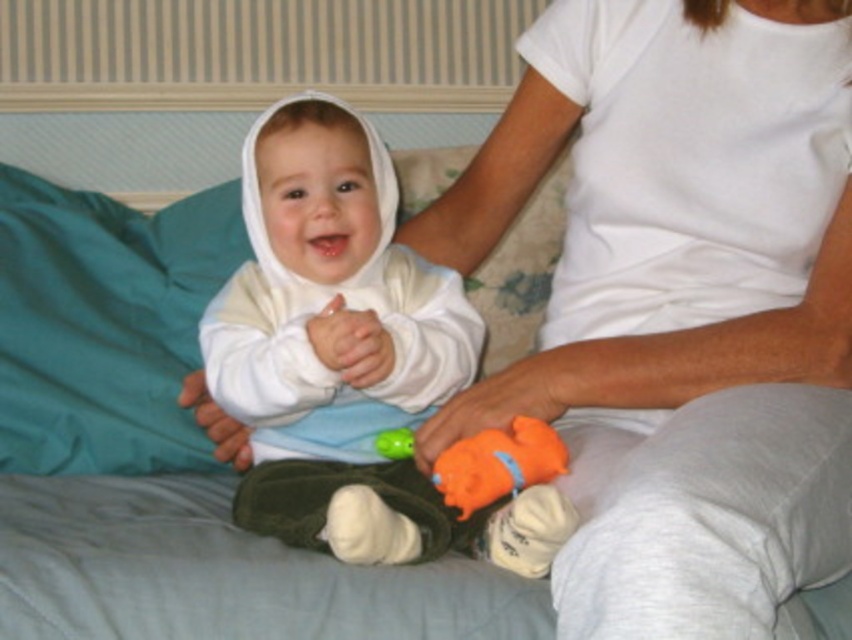
Is white soft baby at center behind orange rubber duck at lower center?

No.

Does point (435, 365) lie in front of point (481, 440)?

No, (435, 365) is further to viewer.

Locate an element on the screen. The image size is (852, 640). white soft baby at center is located at coordinates (348, 356).

Is point (263, 378) in front of point (390, 451)?

Yes.

How much distance is there between white soft baby at center and green fabric toy at center?

white soft baby at center and green fabric toy at center are 18.36 centimeters apart.

What are the coordinates of `white soft baby at center` in the screenshot? It's located at (348, 356).

Does orange rubber duck at lower center have a lesser height compared to green fabric toy at center?

In fact, orange rubber duck at lower center may be taller than green fabric toy at center.

Who is taller, orange rubber duck at lower center or green fabric toy at center?

orange rubber duck at lower center

Identify the location of orange rubber duck at lower center. (498, 465).